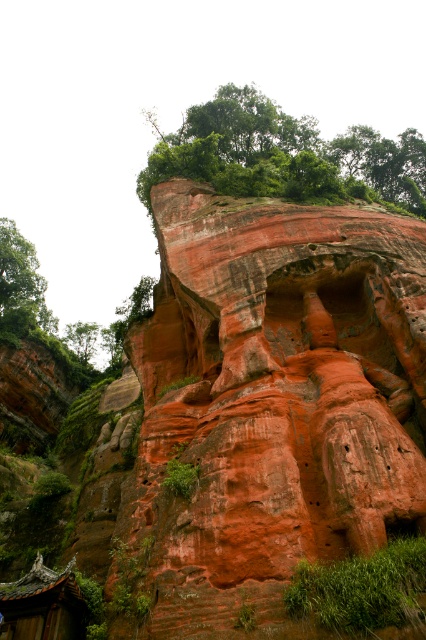
You are a hiker standing at the base of the rock formation. You notice green grass at lower right and a wooden tiled roof hut at lower left. Which object is higher in elevation?

The green grass at lower right is located above the wooden tiled roof hut at lower left, so it is higher in elevation.

You are standing in front of the rock formation and want to take a photo that includes both the wooden tiled roof hut at lower left and the green leafy tree at upper left. Which object should you position to your left side to frame the shot properly?

To frame the shot properly, position the green leafy tree at upper left to your left side since the wooden tiled roof hut at lower left is to the right of it.